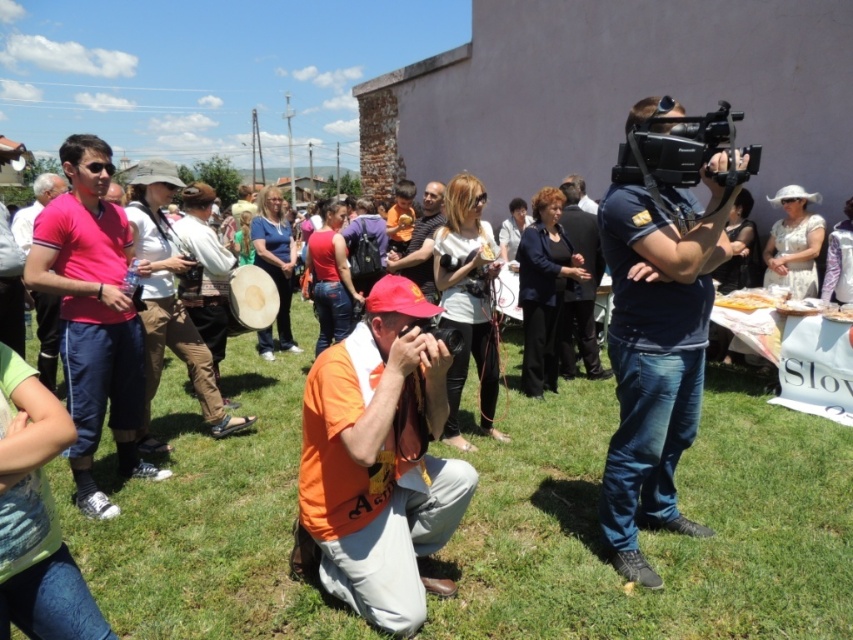
You are a photographer at the event and need to position yourself so that the orange fabric shirt at center is framed to the right of the matte black shirt at center. Based on the current arrangement, is this already achievable without moving anyone?

Yes, the orange fabric shirt at center is already positioned to the right of the matte black shirt at center, so the framing is already correct without needing to move anyone.

You are a photographer at the event and need to identify which person is taller between the dark blue suit at center and the matte black shirt at center. Based on the scene description, which one is taller?

The dark blue suit at center is much taller than the matte black shirt at center according to the description.

You are a photographer trying to capture a clear shot of the dark blue suit at center and the matte black shirt at center. Which of these two subjects is closer to the camera?

The dark blue suit at center is closer to the camera because the matte black shirt at center is positioned behind it.